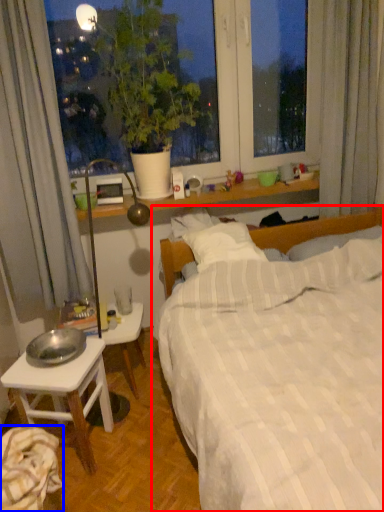
Question: Which object is further to the camera taking this photo, bed (highlighted by a red box) or sheet (highlighted by a blue box)?

Choices:
 (A) bed
 (B) sheet

Answer: (B)